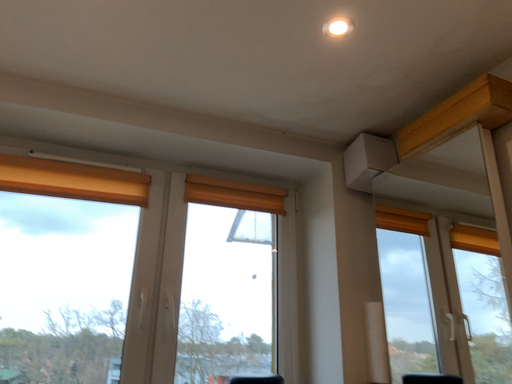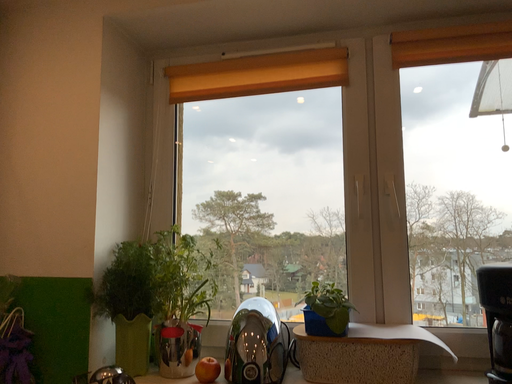
Question: Which way did the camera rotate in the video?

Choices:
 (A) rotated downward
 (B) rotated upward

Answer: (A)